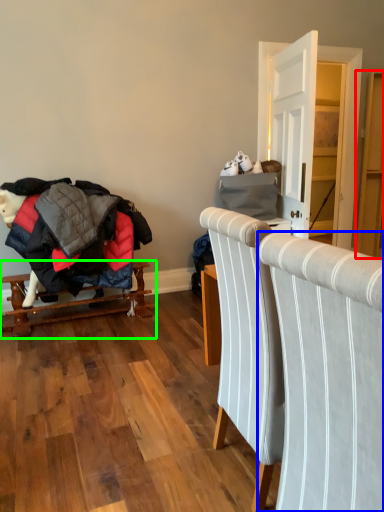
Question: Based on their relative distances, which object is farther from dresser (highlighted by a red box)? Choose from chair (highlighted by a blue box) and furniture (highlighted by a green box).

Choices:
 (A) chair
 (B) furniture

Answer: (A)